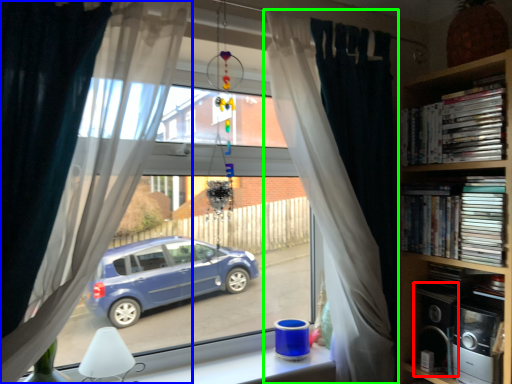
Question: Which object is positioned closest to appliance (highlighted by a red box)? Select from curtain (highlighted by a blue box) and curtain (highlighted by a green box).

Choices:
 (A) curtain
 (B) curtain

Answer: (B)